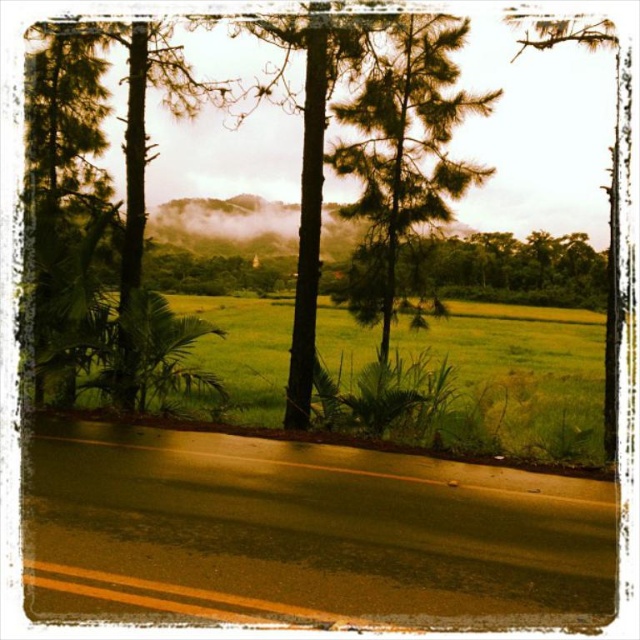
Is green leafy tree at center to the right of green matte tree at center from the viewer's perspective?

Indeed, green leafy tree at center is positioned on the right side of green matte tree at center.

Between point (308, 26) and point (376, 68), which one is positioned behind?

The point (376, 68) is behind.

Find the location of a particular element. green leafy tree at center is located at coordinates (416, 141).

Is green grass at center shorter than green matte tree at center?

In fact, green grass at center may be taller than green matte tree at center.

Is green grass at center bigger than green matte tree at center?

Yes.

You are a GUI agent. You are given a task and a screenshot of the screen. Output one action in this format:
    pyautogui.click(x=<x>, y=<y>)
    Task: Click on the green grass at center
    
    Given the screenshot: What is the action you would take?
    pyautogui.click(x=476, y=380)

Who is shorter, green leafy tree at center or green grass at center?

With less height is green grass at center.

Is green leafy tree at center positioned in front of green grass at center?

That is False.

In order to click on green leafy tree at center in this screenshot , I will do `click(416, 141)`.

Image resolution: width=640 pixels, height=640 pixels. Find the location of `green leafy tree at center`. green leafy tree at center is located at coordinates (416, 141).